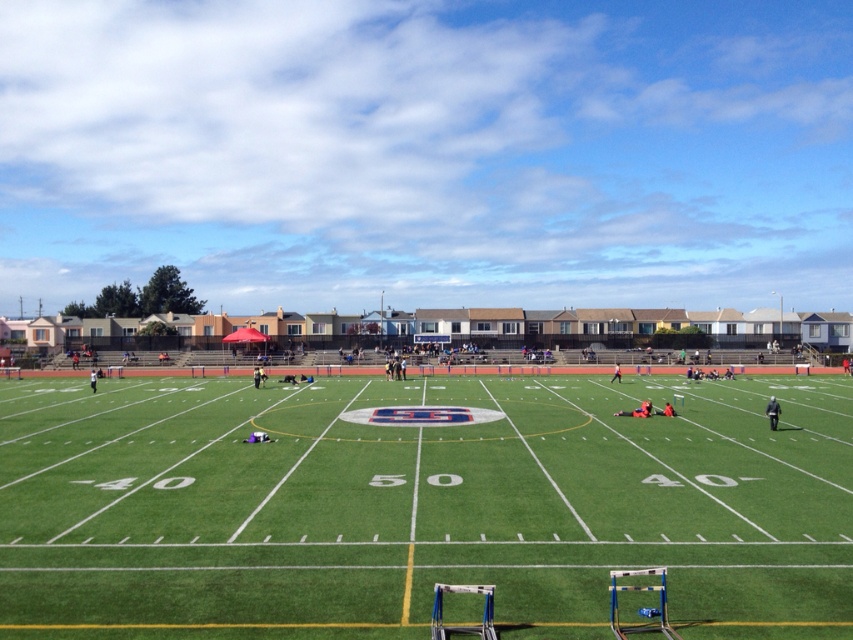
You are standing on the football field and see two points marked on the field. The first point is at coordinates point (440, 605) and the second is at point (650, 401). Which point is closer to you?

Point (440, 605) is closer to the viewer than point (650, 401).

You are an athlete on the football field. You see a blue plastic hurdle at lower right and an orange fabric person at center. Which object is positioned to the left of the other?

The blue plastic hurdle at lower right is to the left of orange fabric person at center.